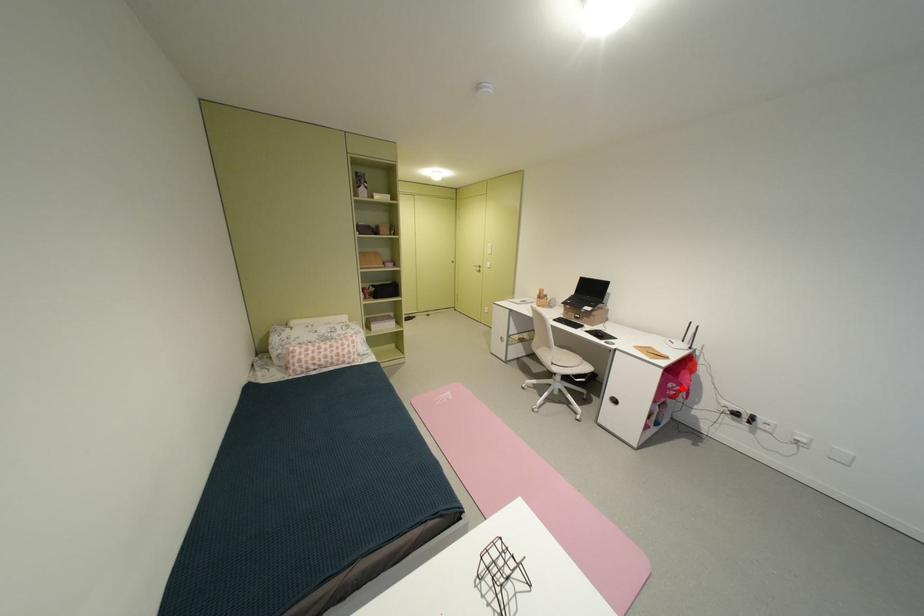
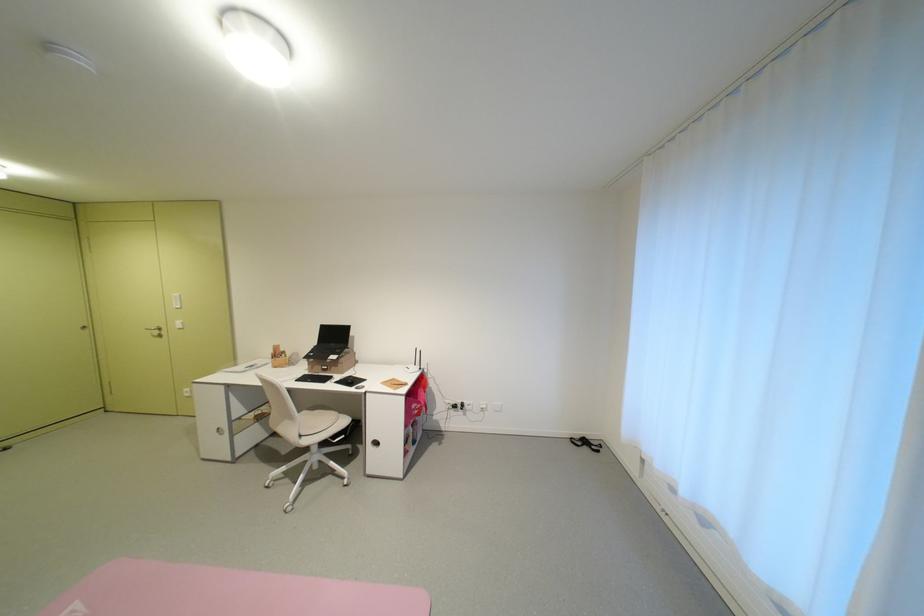
Question: I am providing you with two images of the same scene from different viewpoints. A red point is shown in image1. For the corresponding object point in image2, is it positioned nearer or farther from the camera?

Choices:
 (A) Nearer
 (B) Farther

Answer: (A)